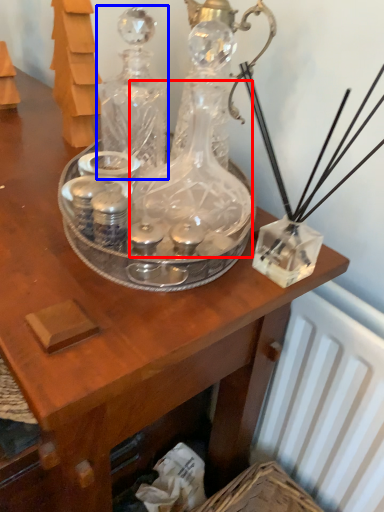
Question: Which object is further to the camera taking this photo, glass bottle (highlighted by a red box) or glass bottle (highlighted by a blue box)?

Choices:
 (A) glass bottle
 (B) glass bottle

Answer: (B)